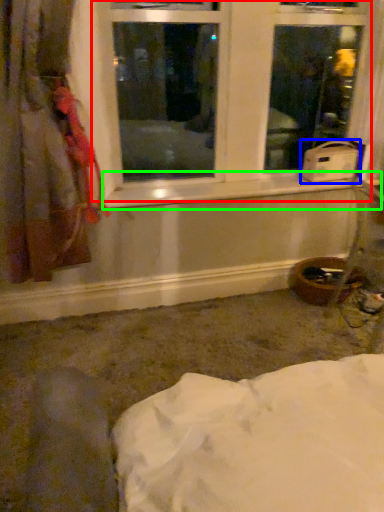
Question: Which object is positioned farthest from window (highlighted by a red box)? Select from water heater (highlighted by a blue box) and window sill (highlighted by a green box).

Choices:
 (A) water heater
 (B) window sill

Answer: (A)